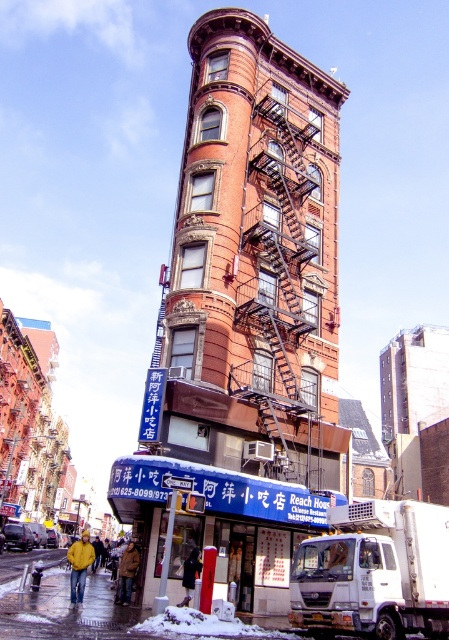
You are standing in front of the red brick building with the blue sign. If you want to find the black metal fire escape at center, where should you look?

The black metal fire escape at center is located at the 2D coordinates point (281, 278).

You are standing in front of the red brick building and want to determine the relative positions of two points marked on the building. Which point is closer to you, point 1 at coordinates (189, 211) or point 2 at coordinates (401, 566)?

Point 1 at coordinates (189, 211) is closer to you because it is further to the viewer than point 2 at coordinates (401, 566).